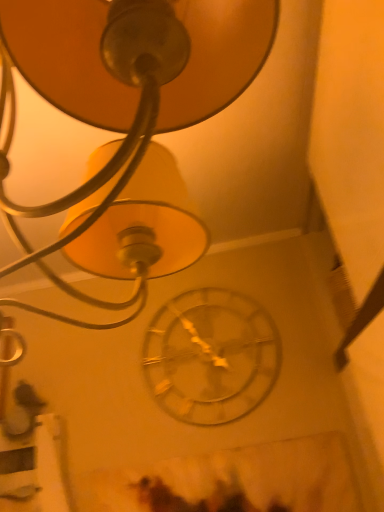
Question: Does metallic gold lampshade at upper center have a larger size compared to metallic silver clock at center?

Choices:
 (A) yes
 (B) no

Answer: (A)

Question: Can you confirm if metallic gold lampshade at upper center is positioned to the left of metallic silver clock at center?

Choices:
 (A) no
 (B) yes

Answer: (B)

Question: From a real-world perspective, is metallic gold lampshade at upper center below metallic silver clock at center?

Choices:
 (A) no
 (B) yes

Answer: (A)

Question: Is the depth of metallic gold lampshade at upper center less than that of metallic silver clock at center?

Choices:
 (A) no
 (B) yes

Answer: (B)

Question: Is metallic gold lampshade at upper center behind metallic silver clock at center?

Choices:
 (A) no
 (B) yes

Answer: (A)

Question: Is metallic gold lampshade at upper center to the right of metallic silver clock at center from the viewer's perspective?

Choices:
 (A) no
 (B) yes

Answer: (A)

Question: Does metallic silver clock at center appear on the right side of metallic gold lampshade at upper center?

Choices:
 (A) yes
 (B) no

Answer: (A)

Question: Is the depth of metallic silver clock at center less than that of metallic gold lampshade at upper center?

Choices:
 (A) no
 (B) yes

Answer: (A)

Question: Does metallic silver clock at center appear on the left side of metallic gold lampshade at upper center?

Choices:
 (A) no
 (B) yes

Answer: (A)

Question: From the image's perspective, would you say metallic silver clock at center is positioned over metallic gold lampshade at upper center?

Choices:
 (A) no
 (B) yes

Answer: (A)

Question: Does metallic silver clock at center have a smaller size compared to metallic gold lampshade at upper center?

Choices:
 (A) yes
 (B) no

Answer: (A)

Question: From a real-world perspective, is metallic silver clock at center on top of metallic gold lampshade at upper center?

Choices:
 (A) yes
 (B) no

Answer: (B)

Question: Considering their positions, is metallic silver clock at center located in front of or behind metallic gold lampshade at upper center?

Choices:
 (A) front
 (B) behind

Answer: (B)